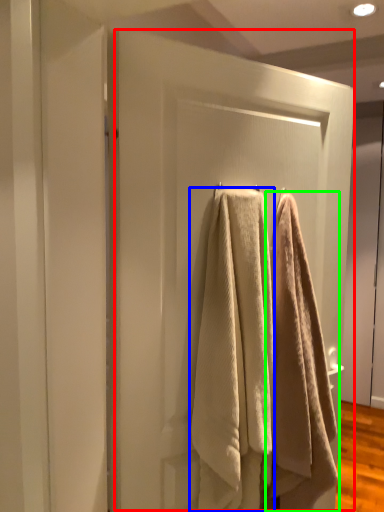
Question: Considering the real-world distances, which object is farthest from screen door (highlighted by a red box)? towel (highlighted by a blue box) or towel (highlighted by a green box)?

Choices:
 (A) towel
 (B) towel

Answer: (B)